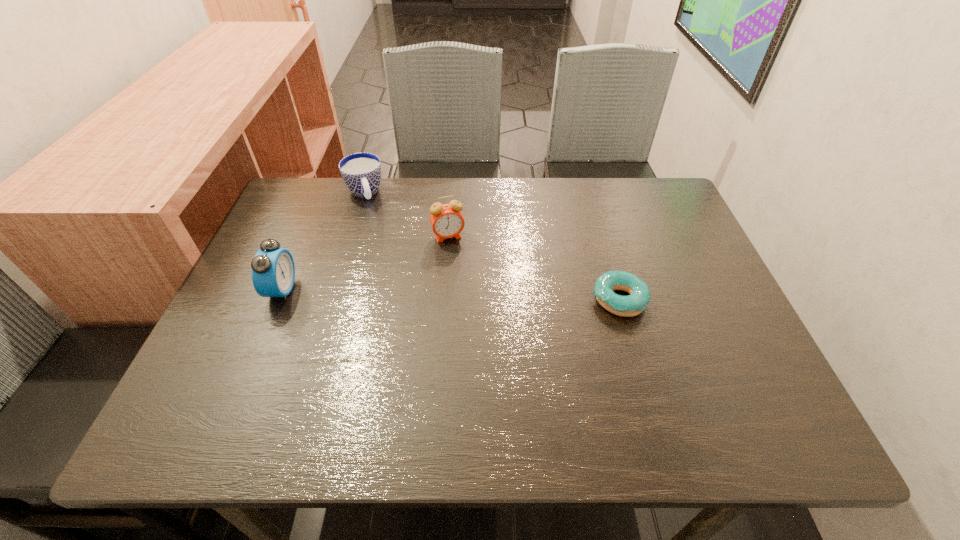
Where is `the left alarm clock`? Image resolution: width=960 pixels, height=540 pixels. the left alarm clock is located at coordinates (273, 270).

Image resolution: width=960 pixels, height=540 pixels. I want to click on the nearer alarm clock, so click(x=273, y=270).

You are a GUI agent. You are given a task and a screenshot of the screen. Output one action in this format:
    pyautogui.click(x=<x>, y=<y>)
    Task: Click on the shortest object
    
    Given the screenshot: What is the action you would take?
    pyautogui.click(x=633, y=304)

Image resolution: width=960 pixels, height=540 pixels. In order to click on doughnut in this screenshot , I will do `click(633, 304)`.

The height and width of the screenshot is (540, 960). In order to click on the second farthest object in this screenshot , I will do `click(447, 221)`.

Find the location of `the second object from right to left`. the second object from right to left is located at coordinates (447, 221).

At what (x,y) coordinates should I click in order to perform the action: click on the farthest object. Please return your answer as a coordinate pair (x, y). This screenshot has width=960, height=540. Looking at the image, I should click on (361, 172).

Locate an element on the screen. This screenshot has height=540, width=960. cup is located at coordinates (361, 172).

You are a GUI agent. You are given a task and a screenshot of the screen. Output one action in this format:
    pyautogui.click(x=<x>, y=<y>)
    Task: Click on the vacant region located on the face of the nearer alarm clock
    
    Given the screenshot: What is the action you would take?
    pyautogui.click(x=430, y=289)

Identify the location of vacant space located 0.330m on the back of the rightmost object. (589, 198).